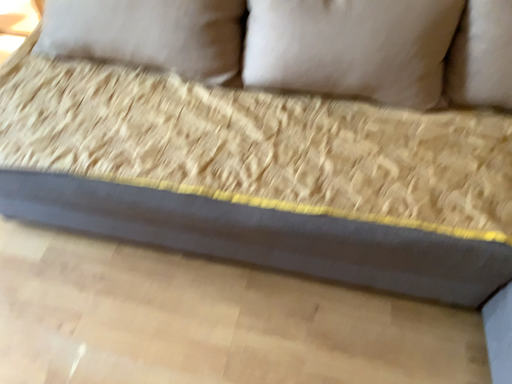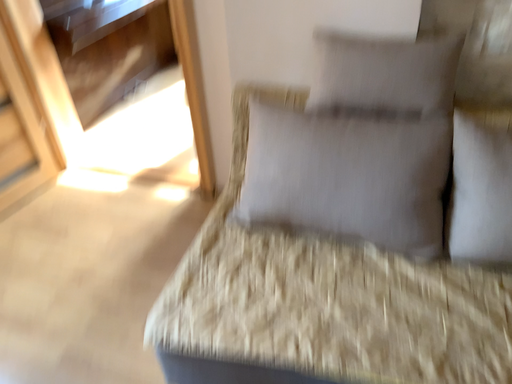
Question: How did the camera likely rotate when shooting the video?

Choices:
 (A) rotated downward
 (B) rotated upward

Answer: (B)